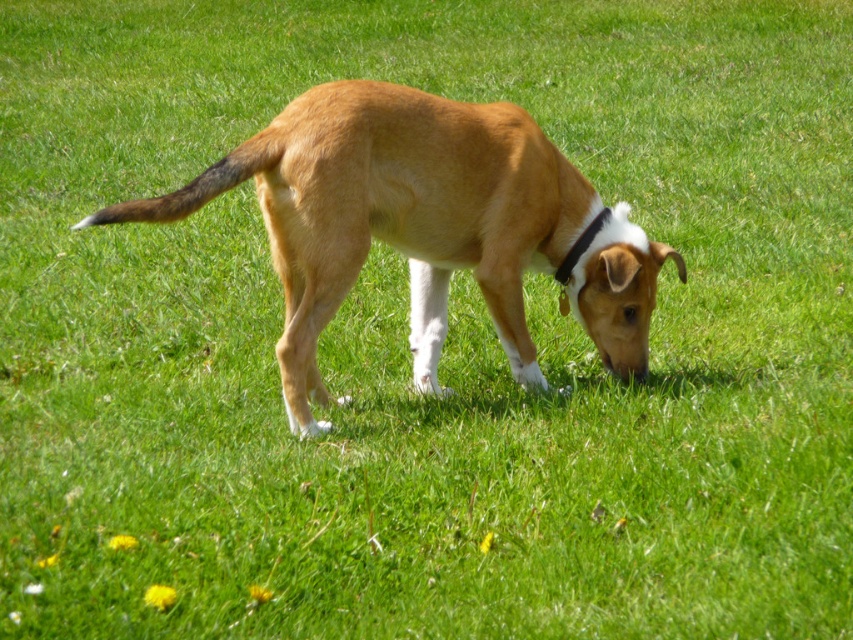
Is point (126, 211) more distant than point (593, 228)?

No, (126, 211) is closer to viewer.

Is point (519, 243) less distant than point (561, 284)?

Yes, point (519, 243) is in front of point (561, 284).

Identify the location of golden fur dog at center. Image resolution: width=853 pixels, height=640 pixels. pos(395,216).